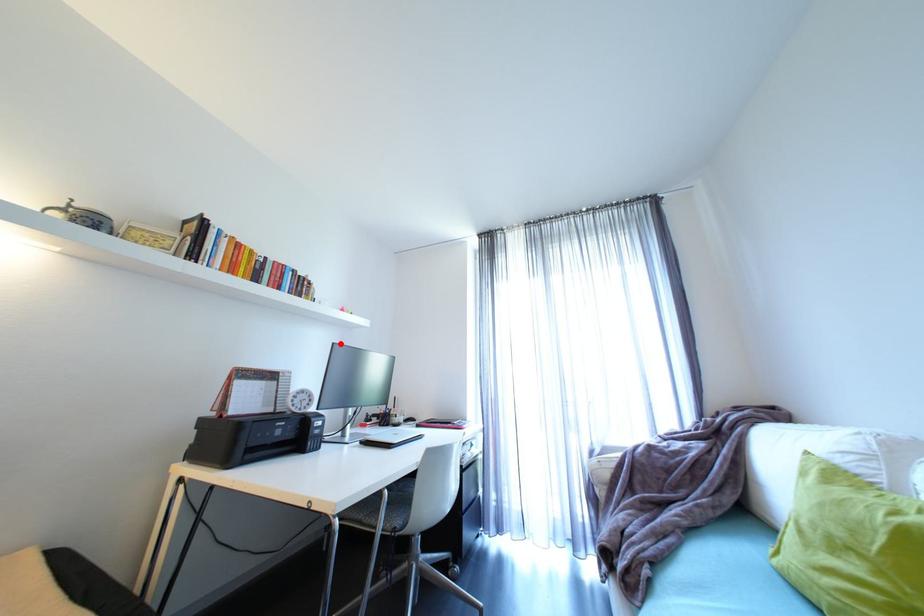
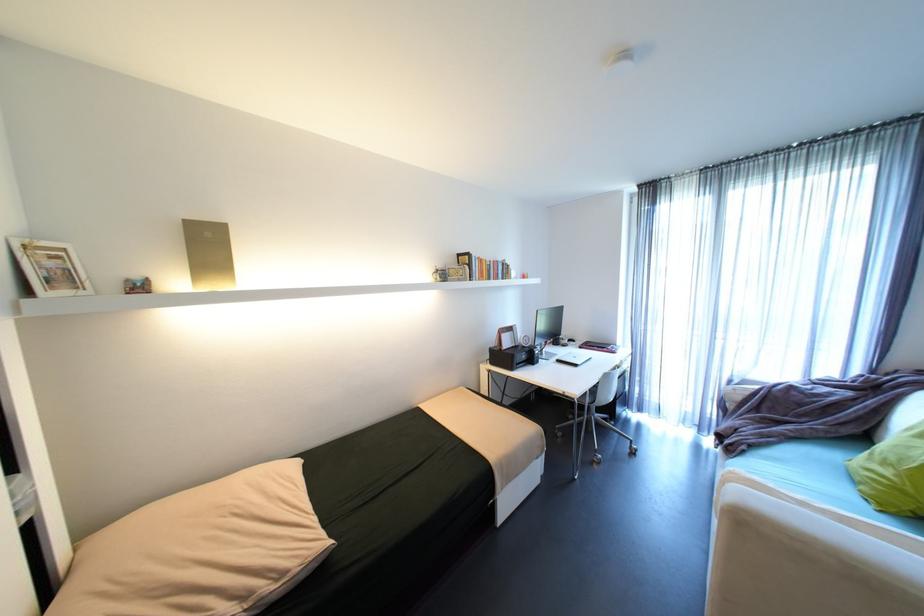
Question: I am providing you with two images of the same scene from different viewpoints. A red point is shown in image1. For the corresponding object point in image2, is it positioned nearer or farther from the camera?

Choices:
 (A) Nearer
 (B) Farther

Answer: (A)